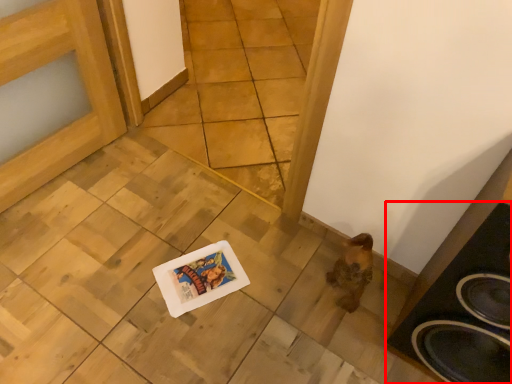
Question: From the image's perspective, considering the relative positions of speaker (annotated by the red box) and tile in the image provided, where is speaker (annotated by the red box) located with respect to the staircase?

Choices:
 (A) below
 (B) above

Answer: (A)